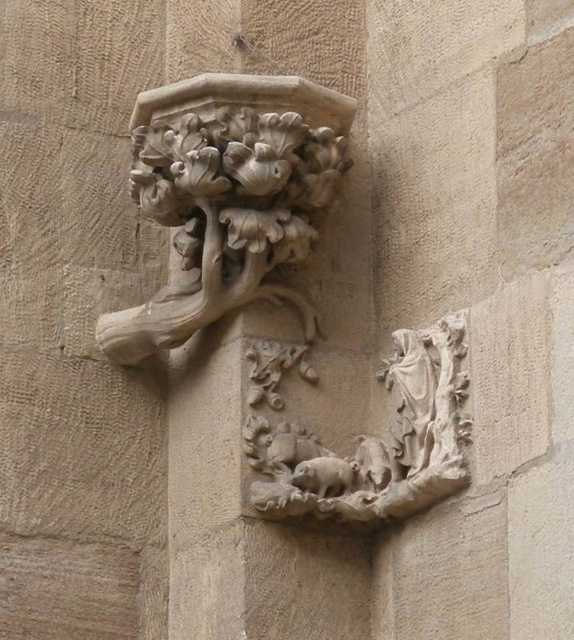
Between carved stone floral motif at upper center and carved stone relief at center, which one is positioned lower?

carved stone relief at center

Which is behind, point (201, 109) or point (273, 432)?

The point (273, 432) is more distant.

Find the location of a particular element. The width and height of the screenshot is (574, 640). carved stone floral motif at upper center is located at coordinates (228, 196).

Locate an element on the screen. This screenshot has height=640, width=574. carved stone floral motif at upper center is located at coordinates (228, 196).